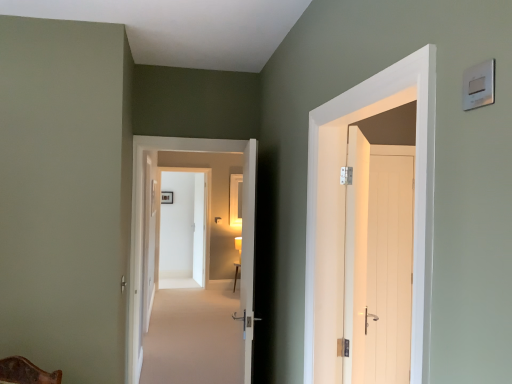
What is the approximate width of white wooden door at center, which ranks as the 5th door in right-to-left order?

4.42 inches.

Measure the distance between white wooden door at center, which appears as the first door when viewed from the back, and camera.

white wooden door at center, which appears as the first door when viewed from the back, and camera are 7.34 meters apart.

What do you see at coordinates (194, 336) in the screenshot? I see `beige carpet at center` at bounding box center [194, 336].

In order to face white glossy door at center, acting as the third door starting from the front, should I rotate leftwards or rightwards?

Turn left approximately 7.889 degrees to face it.

What are the coordinates of `white wood door at right, the third door viewed from the back` in the screenshot? It's located at (378, 262).

Find the location of a particular element. This screenshot has height=384, width=512. silver metallic light switch at upper right is located at coordinates tap(479, 85).

Identify the location of white wooden door at center, which ranks as the 2th door in left-to-right order. The image size is (512, 384). (199, 230).

Is white wooden door at center, which is the 3th door from right to left, situated inside wooden table at center or outside?

white wooden door at center, which is the 3th door from right to left, is not enclosed by wooden table at center.

From a real-world perspective, which object stands above the other?

In real-world perspective, white wooden door at center, placed as the 4th door when sorted from left to right, is above.

Considering the sizes of objects white wooden door at center, the second door viewed from the front, and wooden table at center in the image provided, who is taller, white wooden door at center, the second door viewed from the front, or wooden table at center?

With more height is white wooden door at center, the second door viewed from the front.

From the image's perspective, is white wooden door at center, placed as the 4th door when sorted from left to right, under wooden table at center?

Actually, white wooden door at center, placed as the 4th door when sorted from left to right, appears above wooden table at center in the image.

Is white glossy door at center, the fourth door viewed from the right, completely or partially outside of wooden table at center?

Yes, white glossy door at center, the fourth door viewed from the right, is outside of wooden table at center.

Is white glossy door at center, the fourth door viewed from the right, closer to camera compared to wooden table at center?

Yes, it is in front of wooden table at center.

Does point (250, 142) come closer to viewer compared to point (234, 265)?

Yes, point (250, 142) is closer to viewer.

Can you confirm if white glossy door at center, acting as the third door starting from the front, is taller than wooden table at center?

Indeed, white glossy door at center, acting as the third door starting from the front, has a greater height compared to wooden table at center.

Does silver metallic light switch at upper right turn towards white glossy door at center, the 5th door positioned from the front?

No, silver metallic light switch at upper right is not facing towards white glossy door at center, the 5th door positioned from the front.

Does silver metallic light switch at upper right have a lesser height compared to white glossy door at center, the 5th door positioned from the front?

Indeed, silver metallic light switch at upper right has a lesser height compared to white glossy door at center, the 5th door positioned from the front.

Considering the relative sizes of silver metallic light switch at upper right and white glossy door at center, the 2th door positioned from the back, in the image provided, is silver metallic light switch at upper right thinner than white glossy door at center, the 2th door positioned from the back,?

Yes.

Looking at the image, does silver metallic light switch at upper right seem bigger or smaller compared to white glossy door at center, placed as the 1th door when sorted from left to right?

silver metallic light switch at upper right is smaller than white glossy door at center, placed as the 1th door when sorted from left to right.

What's the angular difference between white wood door at right, the 6th door when ordered from left to right, and white wooden door at upper right, positioned as the 5th door in left-to-right order,'s facing directions?

They differ by 89.3 degrees in their facing directions.

Considering the sizes of objects white wood door at right, the 6th door when ordered from left to right, and white wooden door at upper right, which is the 2th door in right-to-left order, in the image provided, who is thinner, white wood door at right, the 6th door when ordered from left to right, or white wooden door at upper right, which is the 2th door in right-to-left order,?

white wood door at right, the 6th door when ordered from left to right, is thinner.

From the image's perspective, is white wood door at right, the fourth door from the front, positioned above or below white wooden door at upper right, positioned as the 5th door in left-to-right order?

Based on their image positions, white wood door at right, the fourth door from the front, is located beneath white wooden door at upper right, positioned as the 5th door in left-to-right order.

Between white wood door at right, the third door viewed from the back, and white wooden door at upper right, which is the 2th door in right-to-left order, which one has larger size?

white wooden door at upper right, which is the 2th door in right-to-left order, is bigger.

From a real-world perspective, which object rests below the other?

white wooden door at center, the 5th door in the back-to-front sequence.

Is white wooden door at center, which is the 3th door from right to left, positioned before silver metallic light switch at upper right?

No, it is behind silver metallic light switch at upper right.

You are a GUI agent. You are given a task and a screenshot of the screen. Output one action in this format:
    pyautogui.click(x=<x>, y=<y>)
    Task: Click on the light switch that is above the white wooden door at center, the 5th door in the back-to-front sequence (from the image's perspective)
    
    Given the screenshot: What is the action you would take?
    pyautogui.click(x=479, y=85)

How far apart are white wood door at right, the third door viewed from the back, and wooden table at center?

15.40 feet.

Is white wood door at right, the 1th door from the right, inside the boundaries of wooden table at center, or outside?

white wood door at right, the 1th door from the right, cannot be found inside wooden table at center.

Considering the relative sizes of white wood door at right, the 6th door when ordered from left to right, and wooden table at center in the image provided, is white wood door at right, the 6th door when ordered from left to right, wider than wooden table at center?

In fact, white wood door at right, the 6th door when ordered from left to right, might be narrower than wooden table at center.

Between white wooden door at center, which is the 3th door from right to left, and white wooden door at upper right, which appears as the sixth door when viewed from the back, which one has less height?

Standing shorter between the two is white wooden door at upper right, which appears as the sixth door when viewed from the back.

From the image's perspective, is white wooden door at center, which is the 3th door from right to left, below white wooden door at upper right, which appears as the sixth door when viewed from the back?

Indeed, from the image's perspective, white wooden door at center, which is the 3th door from right to left, is shown beneath white wooden door at upper right, which appears as the sixth door when viewed from the back.

Between white wooden door at center, placed as the 4th door when sorted from left to right, and white wooden door at upper right, which is the 2th door in right-to-left order, which one has smaller size?

white wooden door at center, placed as the 4th door when sorted from left to right, is smaller.

Where is `table that is behind the white wooden door at center, placed as the 4th door when sorted from left to right`? The image size is (512, 384). table that is behind the white wooden door at center, placed as the 4th door when sorted from left to right is located at coordinates (236, 274).

Where is `the 5th door above when counting from the wooden table at center (from the image's perspective)`? The height and width of the screenshot is (384, 512). the 5th door above when counting from the wooden table at center (from the image's perspective) is located at coordinates (142, 225).

Consider the image. Which object lies nearer to the anchor point white glossy door at center, the fourth door viewed from the right, silver metallic light switch at upper right or white wooden door at center, the 5th door in the back-to-front sequence?

white wooden door at center, the 5th door in the back-to-front sequence, is positioned closer to the anchor white glossy door at center, the fourth door viewed from the right.

Considering their positions, is white glossy door at center, the 2th door positioned from the back, positioned closer to wooden table at center than white glossy door at center, which appears as the fourth door when viewed from the back?

The object closer to wooden table at center is white glossy door at center, the 2th door positioned from the back.

Looking at the image, which one is located closer to beige carpet at center, white wooden door at center, the second door viewed from the front, or silver metallic light switch at upper right?

white wooden door at center, the second door viewed from the front.

Estimate the real-world distances between objects in this image. Which object is further from white wooden door at center, which ranks as the 5th door in right-to-left order, white wooden door at upper right, which appears as the sixth door when viewed from the back, or silver metallic light switch at upper right?

Among the two, silver metallic light switch at upper right is located further to white wooden door at center, which ranks as the 5th door in right-to-left order.

Considering their positions, is beige carpet at center positioned closer to silver metallic light switch at upper right than wooden table at center?

beige carpet at center lies closer to silver metallic light switch at upper right than the other object.

When comparing their distances from white wooden door at center, the second door viewed from the front, does white wooden door at upper right, positioned as the 5th door in left-to-right order, or white glossy door at center, which appears as the fourth door when viewed from the back, seem further?

white wooden door at upper right, positioned as the 5th door in left-to-right order, is positioned further to the anchor white wooden door at center, the second door viewed from the front.

Looking at the image, which one is located closer to silver metallic light switch at upper right, wooden table at center or white glossy door at center, acting as the third door starting from the front?

Among the two, white glossy door at center, acting as the third door starting from the front, is located nearer to silver metallic light switch at upper right.

Estimate the real-world distances between objects in this image. Which object is closer to wooden table at center, white wooden door at upper right, positioned as the 5th door in left-to-right order, or white wood door at right, the third door viewed from the back?

white wood door at right, the third door viewed from the back, is positioned closer to the anchor wooden table at center.

I want to click on path positioned between white glossy door at center, acting as the third door starting from the front, and white glossy door at center, the 2th door positioned from the back, from near to far, so click(x=194, y=336).

Identify the location of path between white wooden door at upper right, which appears as the first door when viewed from the front, and wooden table at center in the front-back direction. (194, 336).

Identify the location of table positioned between silver metallic light switch at upper right and white wooden door at center, which appears as the first door when viewed from the back, from near to far. click(236, 274).

Locate an element on the screen. path between white wooden door at upper right, which appears as the first door when viewed from the front, and white wooden door at center, which appears as the first door when viewed from the back, in the front-back direction is located at coordinates (194, 336).